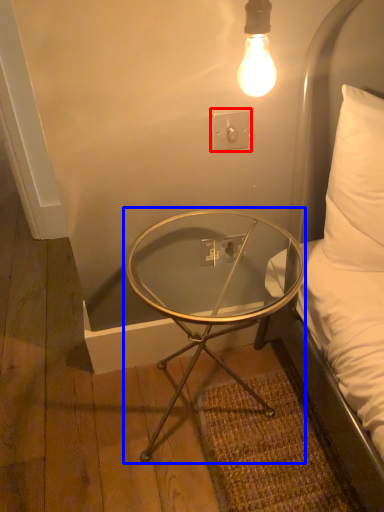
Question: Which object is further to the camera taking this photo, electric outlet (highlighted by a red box) or coffee table (highlighted by a blue box)?

Choices:
 (A) electric outlet
 (B) coffee table

Answer: (A)